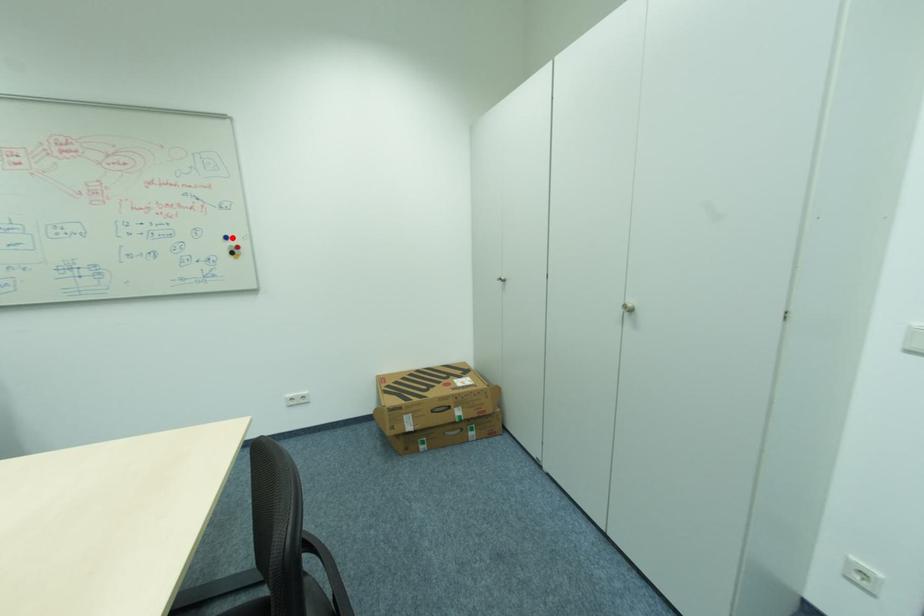
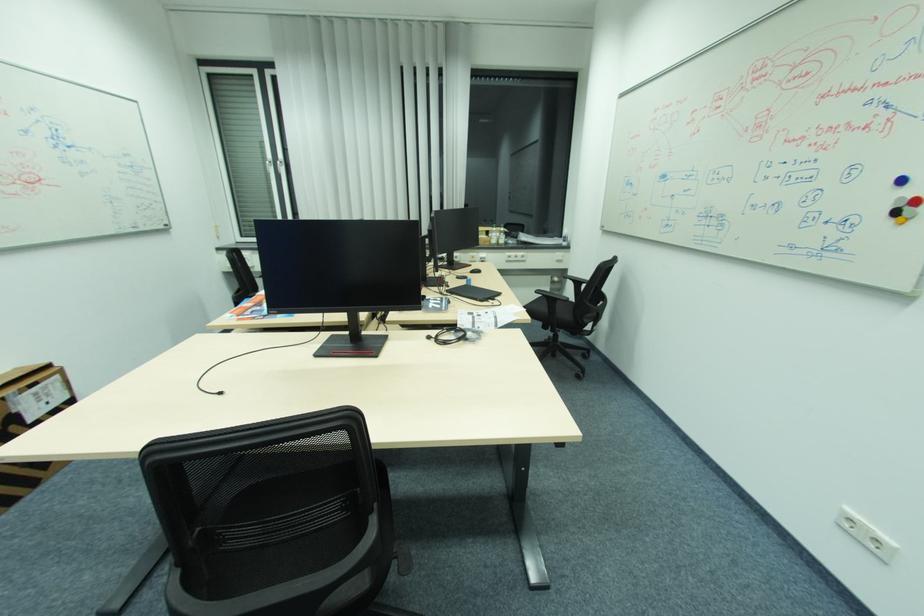
Locate, in the second image, the point that corresponds to the highlighted location in the first image.

(908, 180)